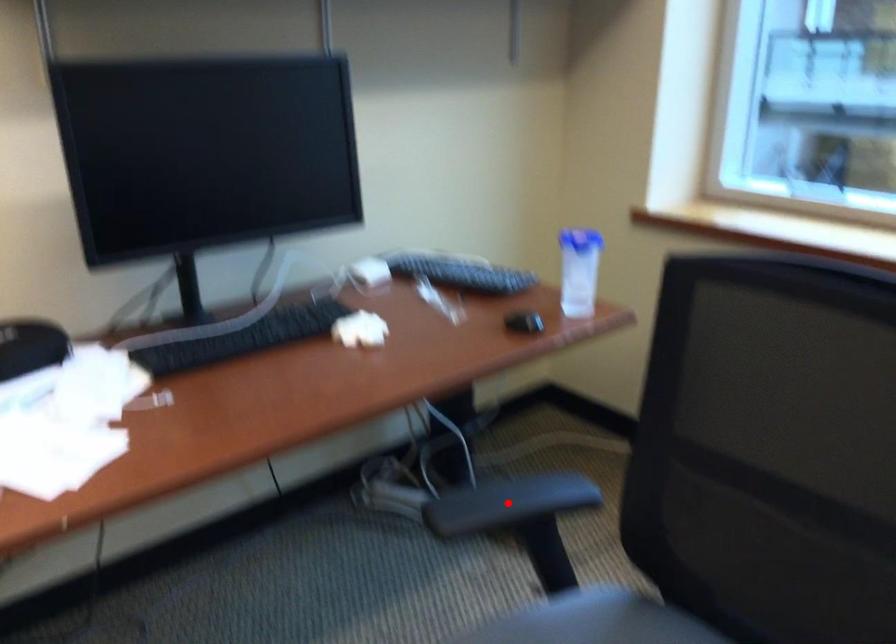
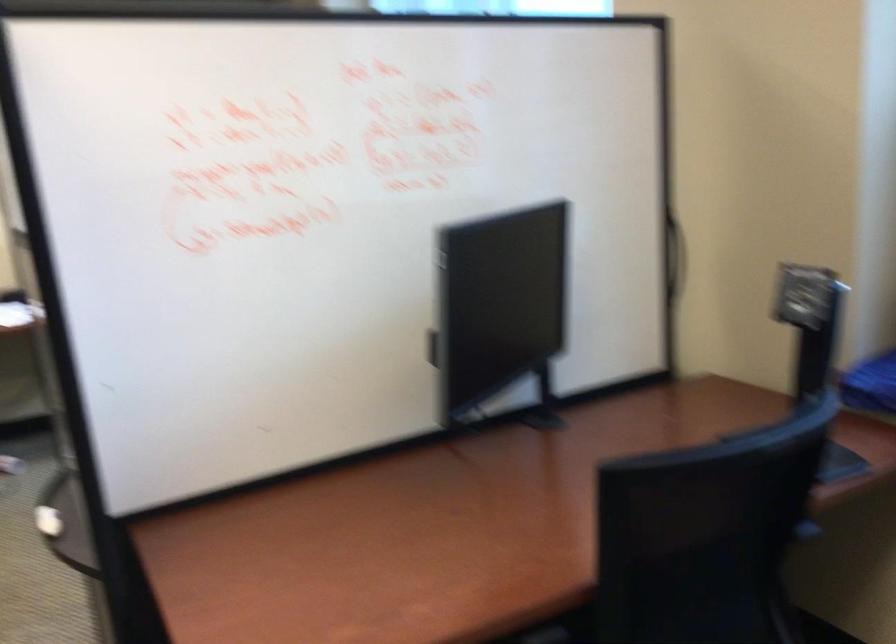
Question: I am providing you with two images of the same scene from different viewpoints. A red point is marked on the first image. Can you still see the location of the red point in image 2?

Choices:
 (A) Yes
 (B) No

Answer: (B)